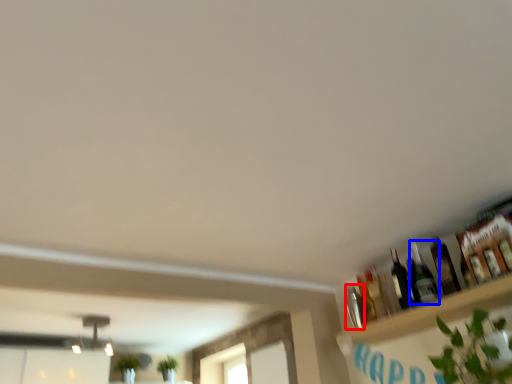
Question: Which object appears farthest to the camera in this image, bottle (highlighted by a red box) or bottle (highlighted by a blue box)?

Choices:
 (A) bottle
 (B) bottle

Answer: (A)